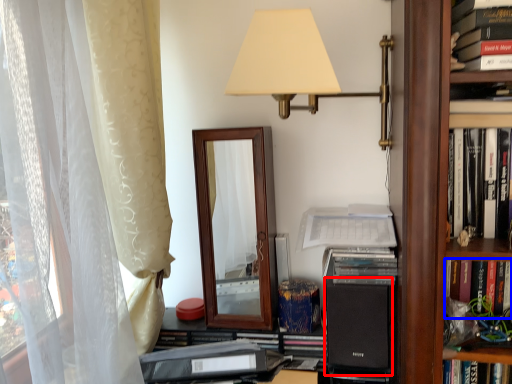
Question: Among these objects, which one is farthest to the camera, speaker (highlighted by a red box) or book (highlighted by a blue box)?

Choices:
 (A) speaker
 (B) book

Answer: (A)